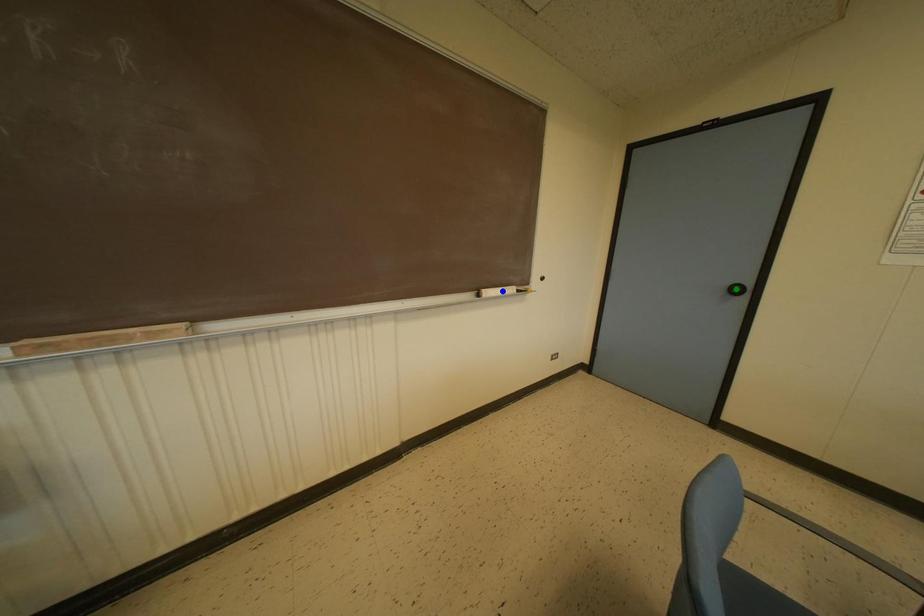
Order these from nearest to farthest:
yellow point | green point | blue point

yellow point < blue point < green point